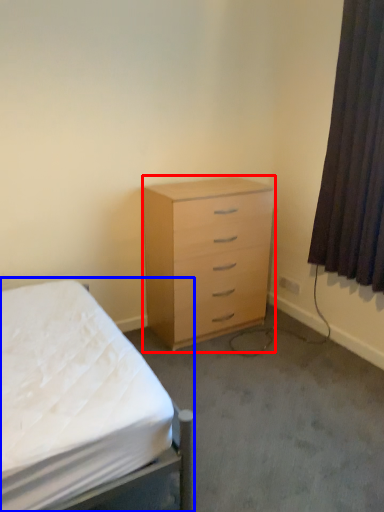
Question: Which object appears closest to the camera in this image, chest of drawers (highlighted by a red box) or bed (highlighted by a blue box)?

Choices:
 (A) chest of drawers
 (B) bed

Answer: (B)